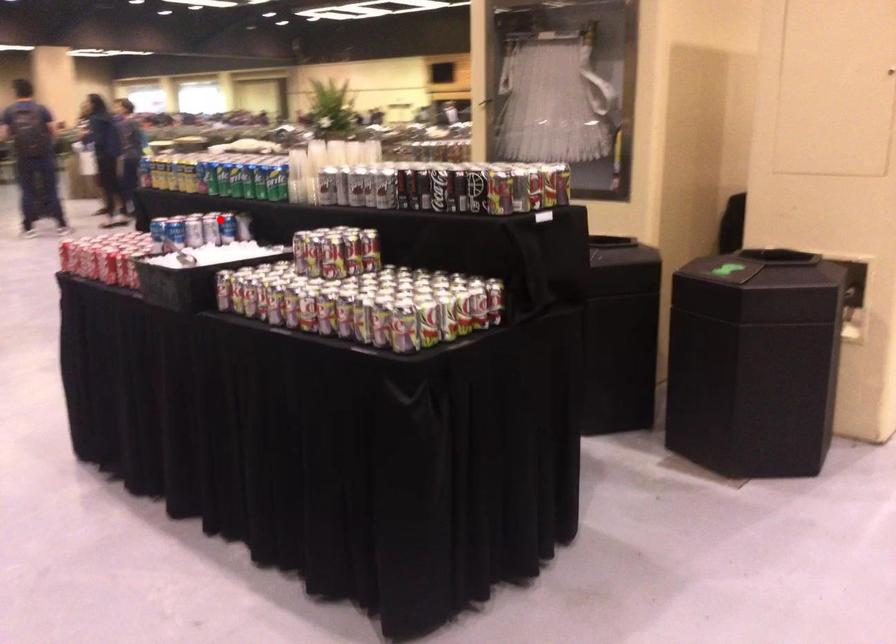
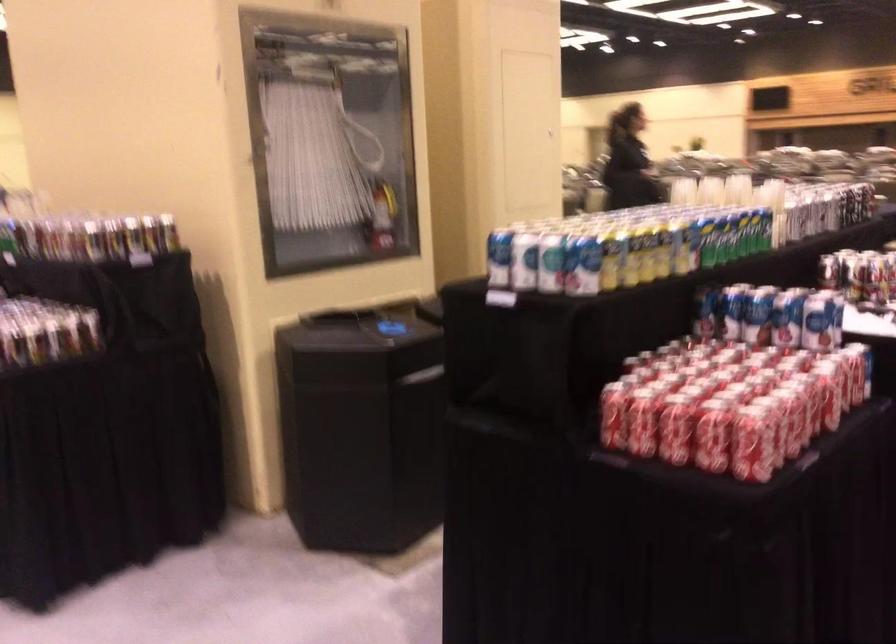
Find the pixel in the second image that matches the highlighted location in the first image.

(703, 312)